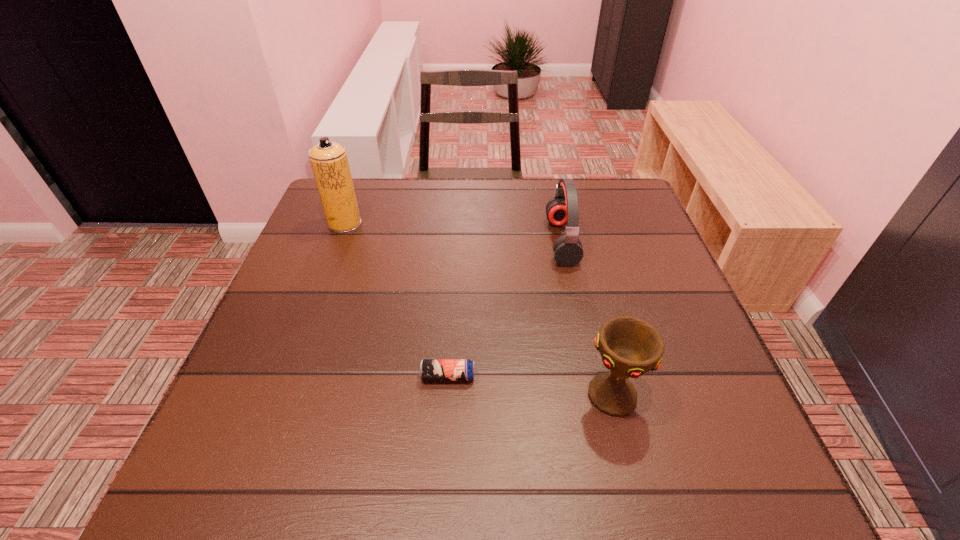
Select which object is the third closest to the earphone. Please provide its 2D coordinates. Your answer should be formatted as a tuple, i.e. [(x, y)], where the tuple contains the x and y coordinates of a point satisfying the conditions above.

[(329, 162)]

This screenshot has width=960, height=540. What are the coordinates of `the third closest object to the tallest object` in the screenshot? It's located at (630, 347).

Find the location of a particular element. The width and height of the screenshot is (960, 540). vacant space that satisfies the following two spatial constraints: 1. on the ear cups of the chalice; 2. on the left side of the earphone is located at coordinates (595, 396).

Where is `free location that satisfies the following two spatial constraints: 1. on the front side of the leftmost object; 2. on the right side of the chalice`? The width and height of the screenshot is (960, 540). free location that satisfies the following two spatial constraints: 1. on the front side of the leftmost object; 2. on the right side of the chalice is located at coordinates (279, 396).

Locate an element on the screen. This screenshot has height=540, width=960. free point that satisfies the following two spatial constraints: 1. on the front side of the leftmost object; 2. on the right side of the beer can is located at coordinates (287, 376).